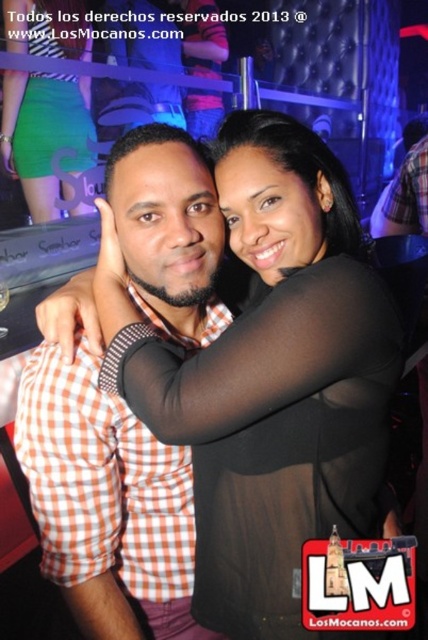
You are a photographer standing at the entrance of the nightclub. You want to take a photo of both the black sheer top at center and the green matte skirt at lower left without any obstruction. Given that your camera has a maximum focus range of 6 feet, will you be able to capture both subjects in focus?

The distance between the black sheer top at center and the green matte skirt at lower left is 6.63 feet, which exceeds the camera maximum focus range of 6 feet. Therefore, you will not be able to capture both subjects in focus.

In the scene shown: You are a photographer at the event and need to frame a shot that includes both the black sheer top at center and the orange checkered shirt at center. If your camera has a fixed width, which clothing item would you prioritize to ensure it fits entirely within the frame?

The orange checkered shirt at center is narrower than the black sheer top at center. Since the black sheer top at center is wider, you should prioritize framing the black sheer top at center to ensure it fits within the fixed width of the camera frame.